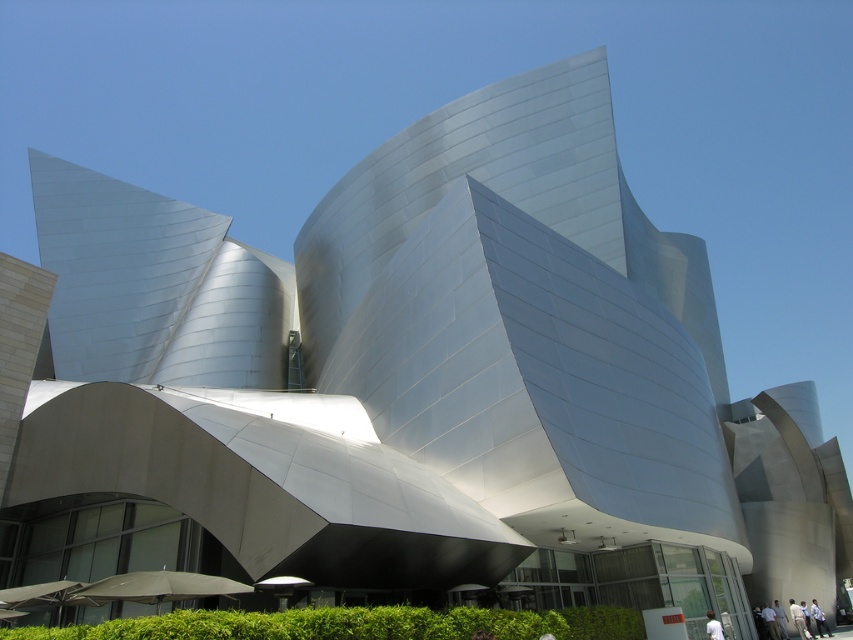
Question: Does white matte person at lower right appear over light blue shirt at lower right?

Choices:
 (A) no
 (B) yes

Answer: (B)

Question: Can you confirm if light blue shirt at lower right is smaller than white matte shirt at lower right?

Choices:
 (A) no
 (B) yes

Answer: (A)

Question: Which point is farther to the camera?

Choices:
 (A) (798, 614)
 (B) (817, 605)
 (C) (717, 637)

Answer: (B)

Question: Among these objects, which one is nearest to the camera?

Choices:
 (A) white matte shirt at lower right
 (B) light blue shirt at lower right
 (C) white matte person at lower right

Answer: (A)

Question: Is the position of white matte person at lower right more distant than that of white matte shirt at lower right?

Choices:
 (A) no
 (B) yes

Answer: (B)

Question: Which point appears farthest from the camera in this image?

Choices:
 (A) (714, 625)
 (B) (821, 627)

Answer: (B)